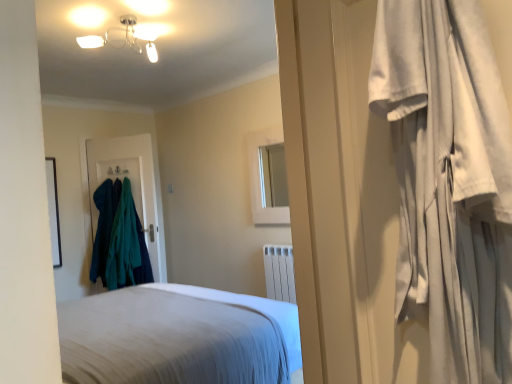
I want to click on blank space situated above white soft bed at center, the 1th bed from the bottom (from a real-world perspective), so click(130, 306).